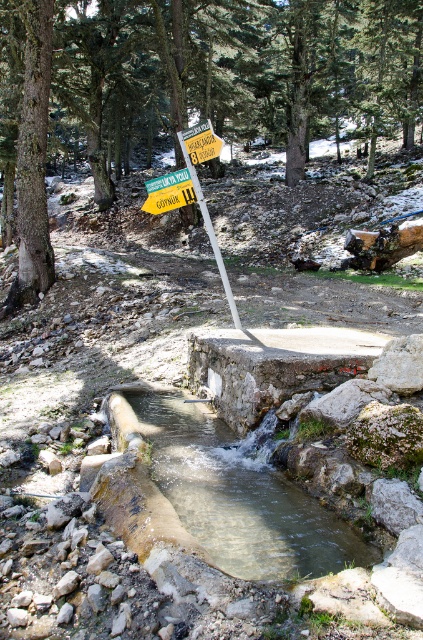
Is brown rough tree at upper center positioned behind clear water at stream center?

Yes.

Does brown rough tree at upper center appear on the left side of clear water at stream center?

Correct, you'll find brown rough tree at upper center to the left of clear water at stream center.

Between point (5, 120) and point (172, 481), which one is positioned behind?

The point (5, 120) is more distant.

The height and width of the screenshot is (640, 423). Find the location of `brown rough tree at upper center`. brown rough tree at upper center is located at coordinates (200, 84).

Between point (334, 563) and point (228, 301), which one is positioned in front?

Point (334, 563)

Who is more distant from viewer, (x=219, y=541) or (x=219, y=259)?

Positioned behind is point (x=219, y=259).

Locate an element on the screen. This screenshot has width=423, height=640. clear water at stream center is located at coordinates (238, 496).

Is point (137, 19) closer to viewer compared to point (194, 184)?

No, (137, 19) is further to viewer.

From the picture: Is brown rough tree at upper center above yellow plastic signpost at center?

Indeed, brown rough tree at upper center is positioned over yellow plastic signpost at center.

Between point (365, 140) and point (169, 208), which one is positioned in front?

Point (169, 208) is more forward.

Locate an element on the screen. The width and height of the screenshot is (423, 640). brown rough tree at upper center is located at coordinates (200, 84).